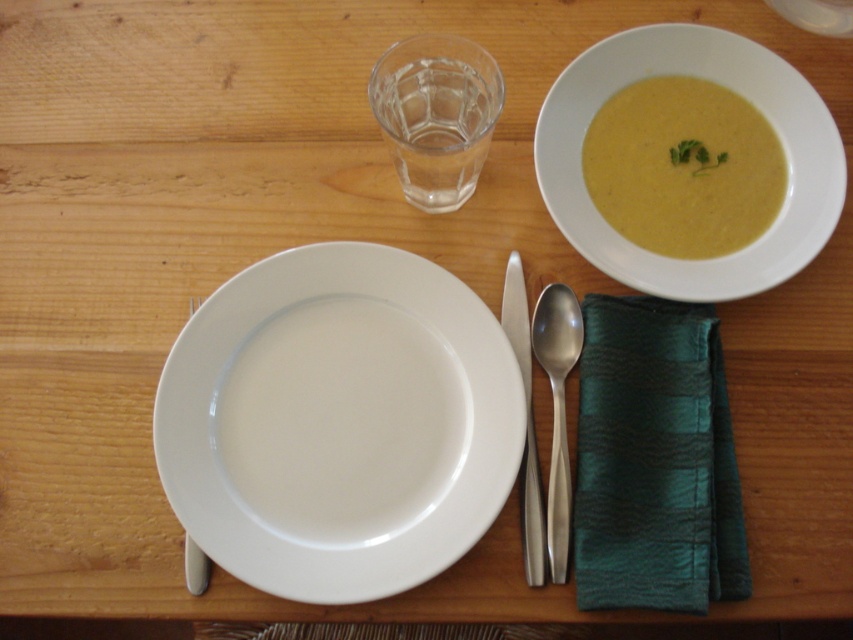
Who is more forward, (550, 148) or (549, 497)?

Point (549, 497) is in front.

Between point (695, 266) and point (556, 310), which one is positioned behind?

Positioned behind is point (556, 310).

Where is `yellow matte soup at upper right`? yellow matte soup at upper right is located at coordinates (727, 88).

Does point (601, 80) come closer to viewer compared to point (195, 593)?

No, (601, 80) is further to viewer.

Is yellow matte soup at upper right above silver metallic fork at lower left?

Correct, yellow matte soup at upper right is located above silver metallic fork at lower left.

Between point (561, 216) and point (190, 556), which one is positioned behind?

Positioned behind is point (561, 216).

Identify the location of yellow matte soup at upper right. (727, 88).

Between point (654, 246) and point (564, 413), which one is positioned in front?

Point (564, 413) is more forward.

What do you see at coordinates (683, 168) in the screenshot? This screenshot has height=640, width=853. I see `yellow creamy soup at upper right` at bounding box center [683, 168].

Is point (712, 225) positioned before point (573, 348)?

No, it is not.

This screenshot has height=640, width=853. I want to click on yellow creamy soup at upper right, so click(683, 168).